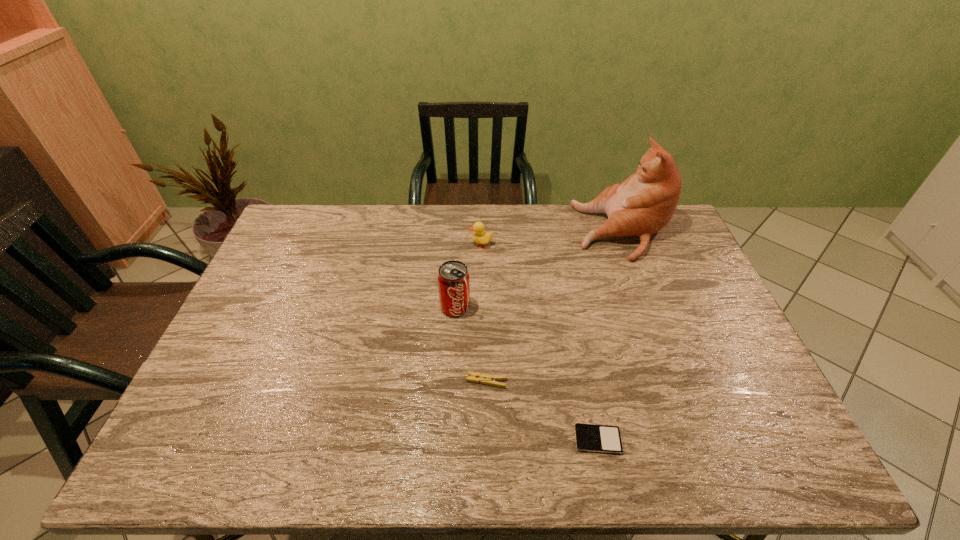
What are the coordinates of `object positioned at the near edge` in the screenshot? It's located at (589, 437).

Locate an element on the screen. This screenshot has width=960, height=540. object that is positioned at the right edge is located at coordinates (643, 204).

The image size is (960, 540). In order to click on object positioned at the far right corner in this screenshot , I will do `click(643, 204)`.

In the image, there is a desktop. At what (x,y) coordinates should I click in order to perform the action: click on free region at the far edge. Please return your answer as a coordinate pair (x, y). The image size is (960, 540). Looking at the image, I should click on (559, 209).

Identify the location of blank area at the left edge. (238, 318).

Find the location of a particular element. This screenshot has width=960, height=540. vacant space at the right edge of the desktop is located at coordinates (711, 325).

I want to click on vacant region at the far left corner of the desktop, so click(x=309, y=226).

Where is `vacant point located between the second tallest object and the cat`? The image size is (960, 540). vacant point located between the second tallest object and the cat is located at coordinates (539, 269).

At what (x,y) coordinates should I click in order to perform the action: click on vacant space that is in between the rightmost object and the second shortest object. Please return your answer as a coordinate pair (x, y). The height and width of the screenshot is (540, 960). Looking at the image, I should click on pyautogui.click(x=555, y=306).

Find the location of a particular element. The image size is (960, 540). vacant space in between the second nearest object and the rightmost object is located at coordinates (555, 306).